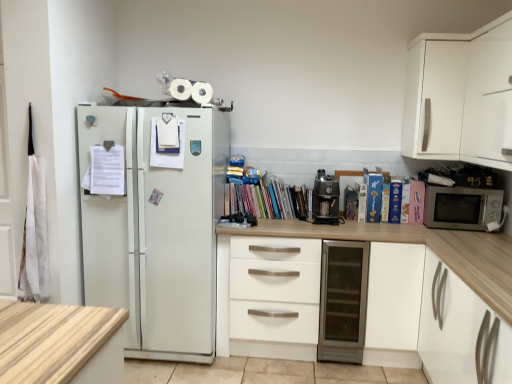
Question: Is metallic glass door fridge at center at the back of hardcover book at right, the 4th paperback book from the left?

Choices:
 (A) no
 (B) yes

Answer: (A)

Question: Could you tell me if hardcover book at right, the 4th paperback book from the left, is turned towards metallic glass door fridge at center?

Choices:
 (A) no
 (B) yes

Answer: (A)

Question: From the image's perspective, is hardcover book at right, the 4th paperback book from the left, above metallic glass door fridge at center?

Choices:
 (A) no
 (B) yes

Answer: (B)

Question: Is metallic glass door fridge at center located within hardcover book at right, the 4th paperback book from the left?

Choices:
 (A) no
 (B) yes

Answer: (A)

Question: Can you confirm if hardcover book at right, the 4th paperback book from the left, is shorter than metallic glass door fridge at center?

Choices:
 (A) no
 (B) yes

Answer: (B)

Question: Is multicolored paperbacks at center bigger or smaller than hardcover book at right, the 4th paperback book from the left?

Choices:
 (A) small
 (B) big

Answer: (B)

Question: Is point (297, 210) closer or farther from the camera than point (408, 188)?

Choices:
 (A) closer
 (B) farther

Answer: (B)

Question: From a real-world perspective, is multicolored paperbacks at center positioned above or below hardcover book at right, which is the 2th paperback book from right to left?

Choices:
 (A) above
 (B) below

Answer: (B)

Question: Is multicolored paperbacks at center spatially inside hardcover book at right, the 4th paperback book from the left, or outside of it?

Choices:
 (A) inside
 (B) outside

Answer: (B)

Question: Is metallic glass door fridge at center wider or thinner than blue matte paperback book at upper right, which appears as the fifth paperback book when viewed from the right?

Choices:
 (A) wide
 (B) thin

Answer: (A)

Question: From the image's perspective, is metallic glass door fridge at center located above or below blue matte paperback book at upper right, positioned as the first paperback book in left-to-right order?

Choices:
 (A) above
 (B) below

Answer: (B)

Question: Is metallic glass door fridge at center in front of or behind blue matte paperback book at upper right, positioned as the first paperback book in left-to-right order, in the image?

Choices:
 (A) front
 (B) behind

Answer: (A)

Question: From a real-world perspective, is metallic glass door fridge at center above or below blue matte paperback book at upper right, which appears as the fifth paperback book when viewed from the right?

Choices:
 (A) below
 (B) above

Answer: (A)

Question: Is metallic glass door fridge at center inside or outside of white matte cabinet at lower right, arranged as the 2th cabinetry when viewed from the top?

Choices:
 (A) inside
 (B) outside

Answer: (B)

Question: Is metallic glass door fridge at center wider or thinner than white matte cabinet at lower right, marked as the first cabinetry in a bottom-to-top arrangement?

Choices:
 (A) wide
 (B) thin

Answer: (B)